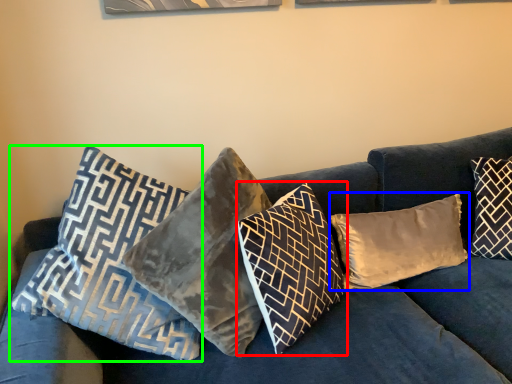
Question: Considering the real-world distances, which object is closest to pillow (highlighted by a red box)? pillow (highlighted by a blue box) or pillow (highlighted by a green box).

Choices:
 (A) pillow
 (B) pillow

Answer: (A)